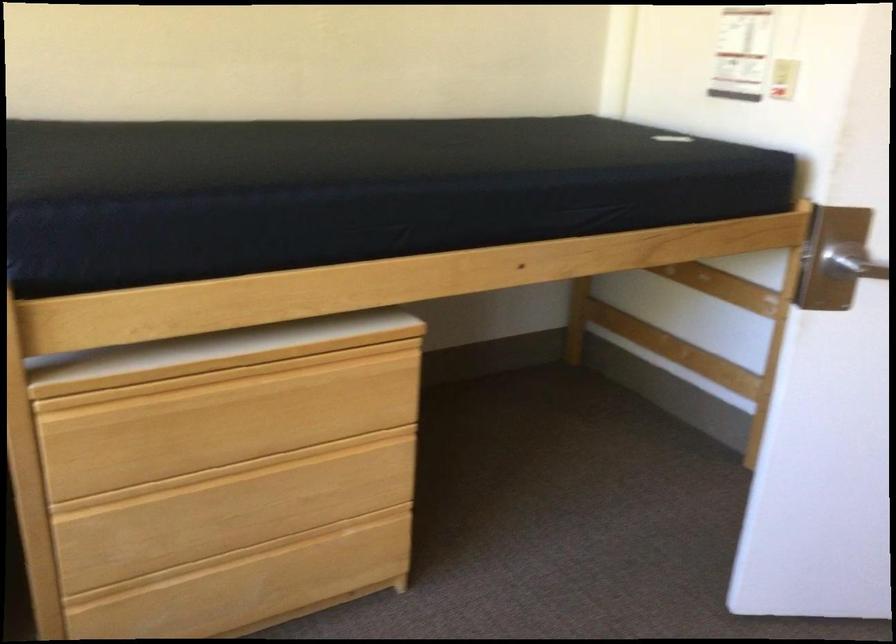
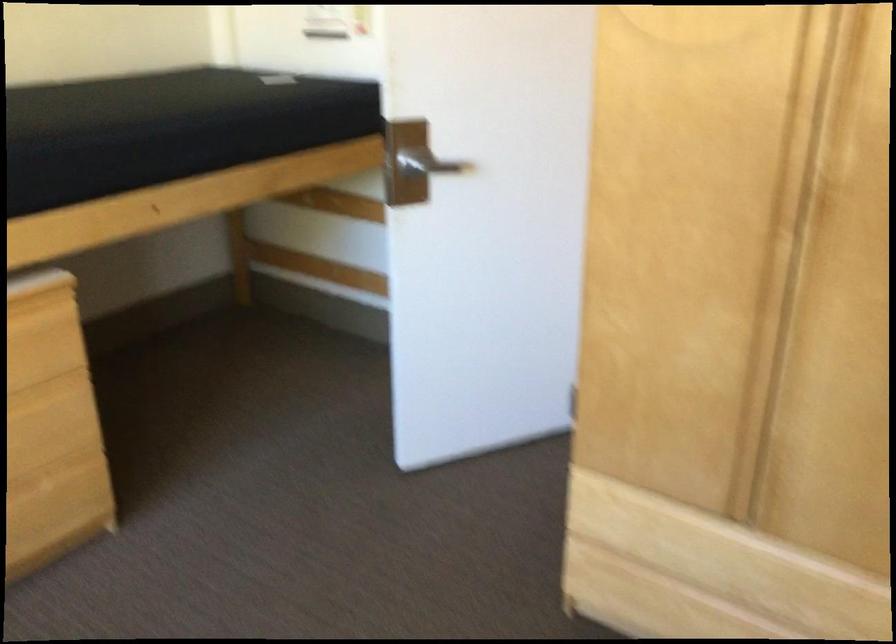
Question: Which direction would the cameraman need to move to produce the second image? Reply with the corresponding letter.

Choices:
 (A) Left
 (B) Right
 (C) Forward
 (D) Backward

Answer: (D)